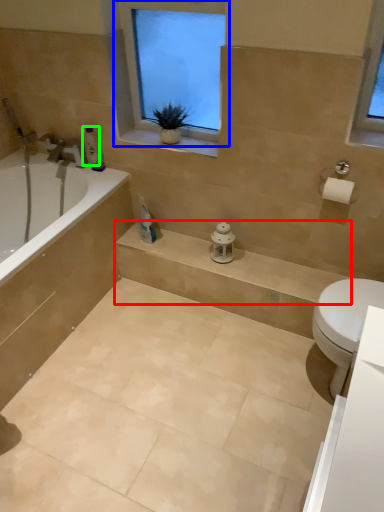
Question: Based on their relative distances, which object is farther from balustrade (highlighted by a red box)? Choose from window (highlighted by a blue box) and toiletry (highlighted by a green box).

Choices:
 (A) window
 (B) toiletry

Answer: (B)